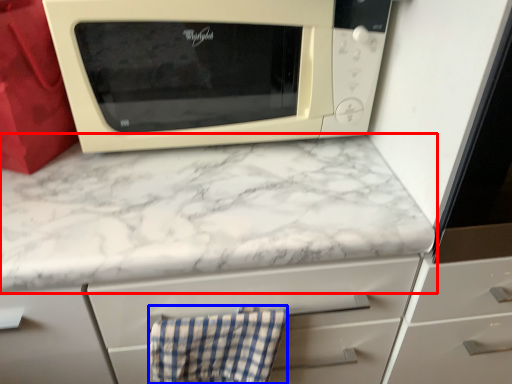
Question: Among these objects, which one is farthest to the camera, countertop (highlighted by a red box) or hand towel (highlighted by a blue box)?

Choices:
 (A) countertop
 (B) hand towel

Answer: (B)